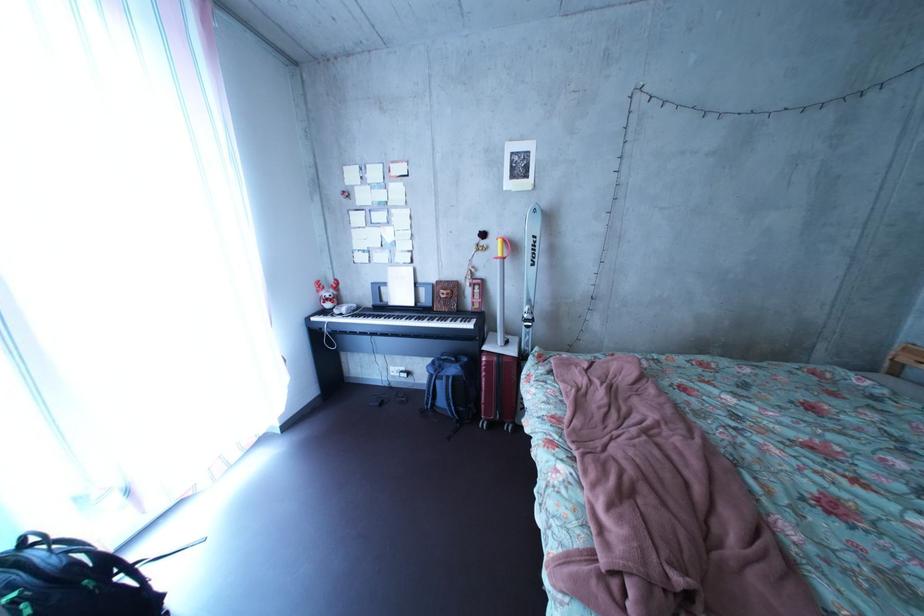
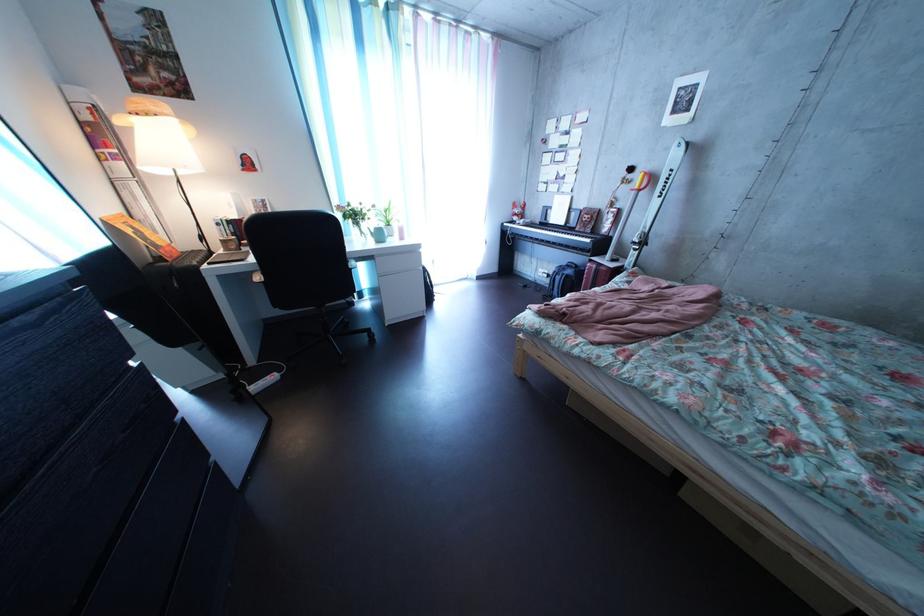
The point at (518, 265) is marked in the first image. Where is the corresponding point in the second image?

(653, 199)